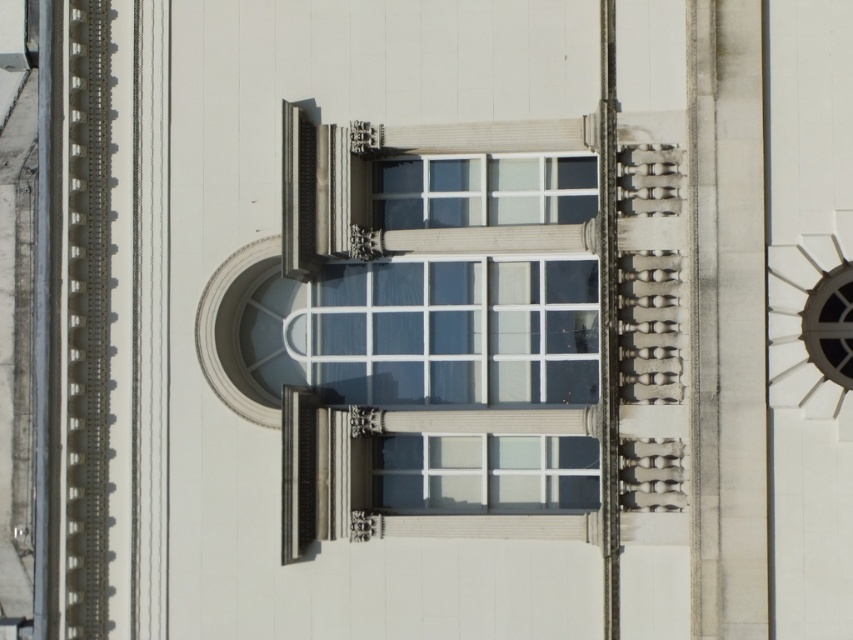
From the picture: Between clear glass window at center and metallic silver clock at right, which one is positioned lower?

metallic silver clock at right is lower down.

Which of these two, clear glass window at center or metallic silver clock at right, stands shorter?

Standing shorter between the two is clear glass window at center.

You are a GUI agent. You are given a task and a screenshot of the screen. Output one action in this format:
    pyautogui.click(x=<x>, y=<y>)
    Task: Click on the clear glass window at center
    This screenshot has width=853, height=640.
    Given the screenshot: What is the action you would take?
    pyautogui.click(x=440, y=326)